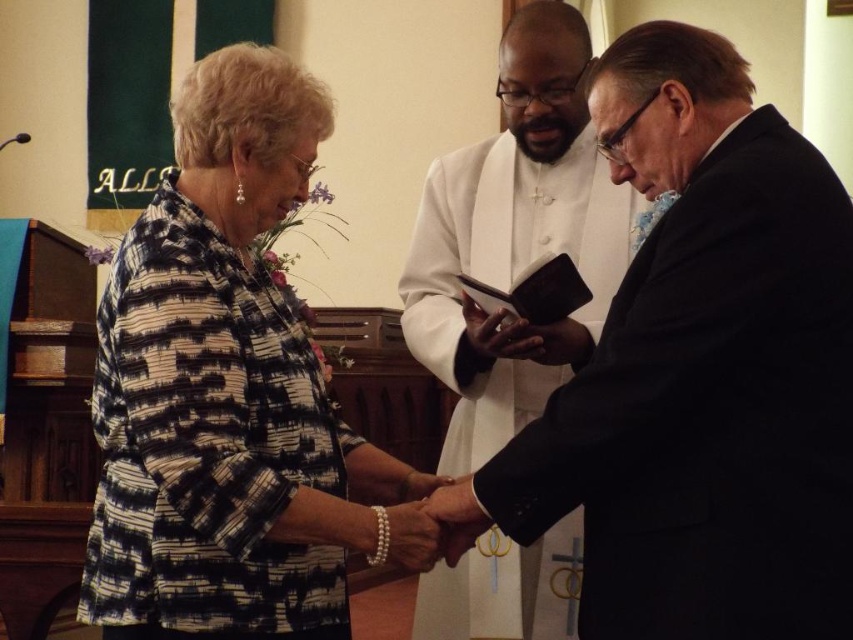
You are standing at the origin point of the coordinate system. You want to move towards the black matte suit at center. Which direction should you move in?

The black matte suit at center is located at coordinate point 0.584 on the x axis and 0.821 on the y axis. Since you are at the origin, you should move in the positive x and positive y direction to reach it.

Looking at this image, you are a photographer at the event and want to ensure that both the black matte suit at center and the patterned fabric dress at left are visible in your photo. Given their height difference, where should you position your camera to capture both effectively?

The black matte suit at center is taller than the patterned fabric dress at left. To capture both effectively, position the camera at a lower angle to ensure the taller black matte suit at center doesn not block the shorter patterned fabric dress at left.